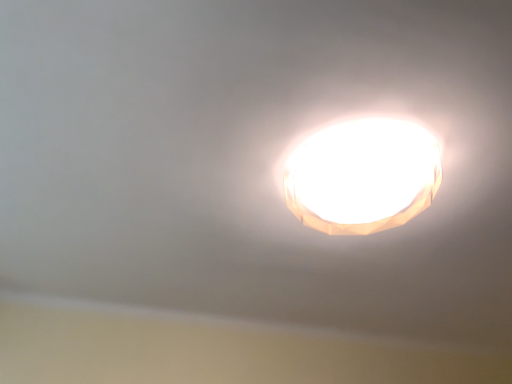
Where is `translucent plastic lamp at center`? translucent plastic lamp at center is located at coordinates (362, 176).

The height and width of the screenshot is (384, 512). What do you see at coordinates (362, 176) in the screenshot?
I see `translucent plastic lamp at center` at bounding box center [362, 176].

This screenshot has height=384, width=512. In order to click on translucent plastic lamp at center in this screenshot , I will do `click(362, 176)`.